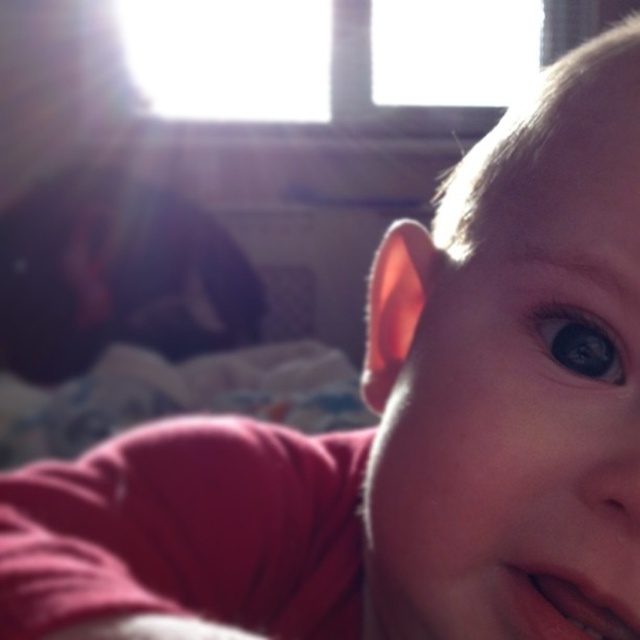
Between point (525, 634) and point (580, 316), which one is positioned in front?

Point (525, 634) is in front.

Which is above, pink glossy lips at lower right or shiny blue eye at center?

shiny blue eye at center

You are a GUI agent. You are given a task and a screenshot of the screen. Output one action in this format:
    pyautogui.click(x=<x>, y=<y>)
    Task: Click on the pink glossy lips at lower right
    This screenshot has width=640, height=640.
    Given the screenshot: What is the action you would take?
    pyautogui.click(x=563, y=604)